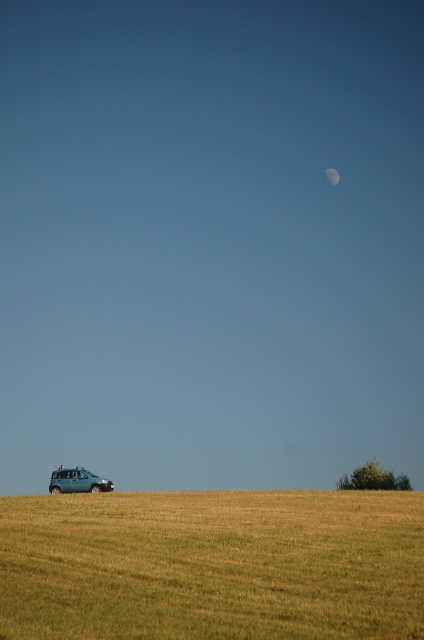
Question: Which point appears farthest from the camera in this image?

Choices:
 (A) (83, 476)
 (B) (145, 538)

Answer: (A)

Question: From the image, what is the correct spatial relationship of golden dry grass at lower center in relation to gray/white textured moon at upper center?

Choices:
 (A) below
 (B) above

Answer: (A)

Question: Which is farther from the gray/white textured moon at upper center?

Choices:
 (A) golden dry grass at lower center
 (B) teal matte car at lower left

Answer: (A)

Question: Does golden dry grass at lower center have a smaller size compared to teal matte car at lower left?

Choices:
 (A) yes
 (B) no

Answer: (A)

Question: Can you confirm if golden dry grass at lower center is bigger than teal matte car at lower left?

Choices:
 (A) yes
 (B) no

Answer: (B)

Question: Which object is closer to the camera taking this photo?

Choices:
 (A) golden dry grass at lower center
 (B) teal matte car at lower left

Answer: (A)